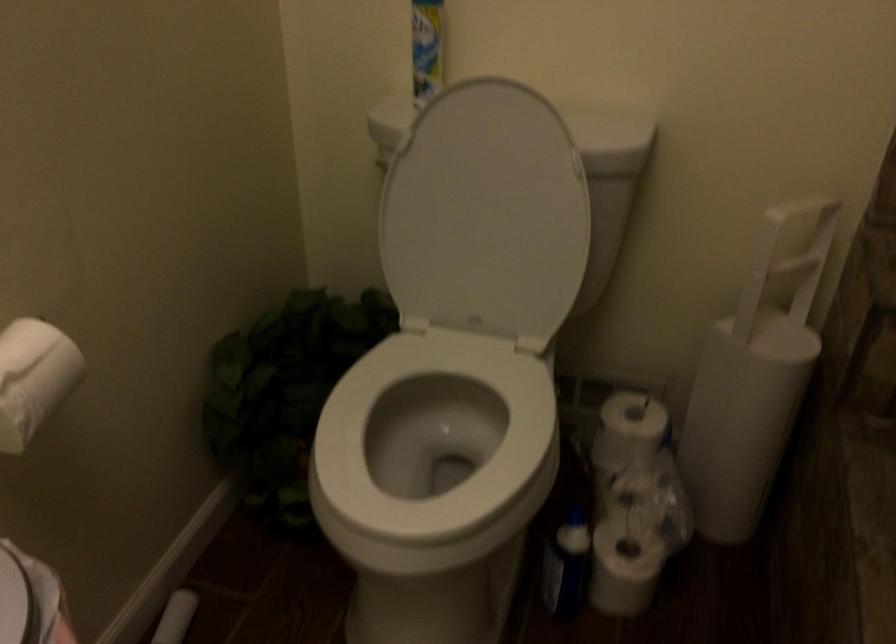
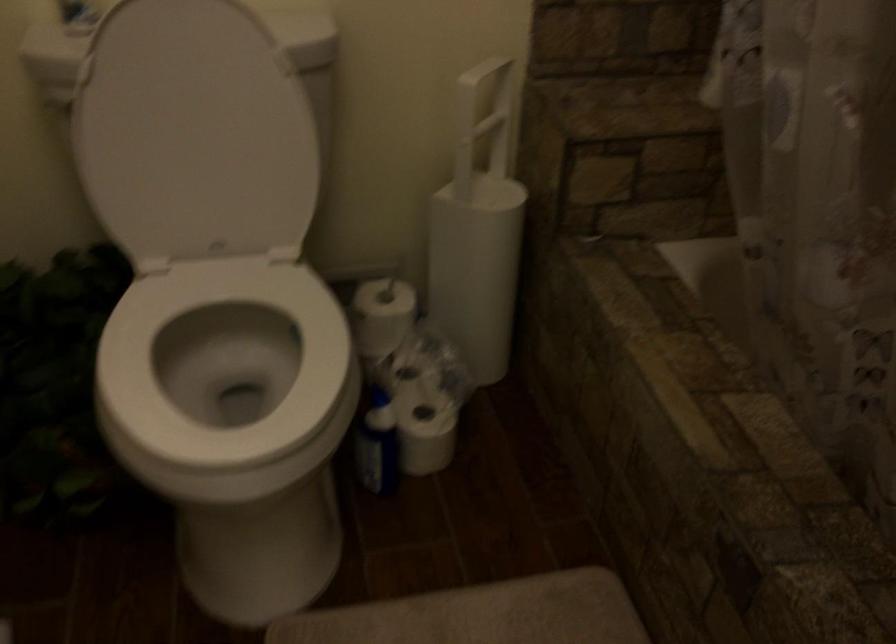
Where in the second image is the point corresponding to (618,570) from the first image?

(426, 436)